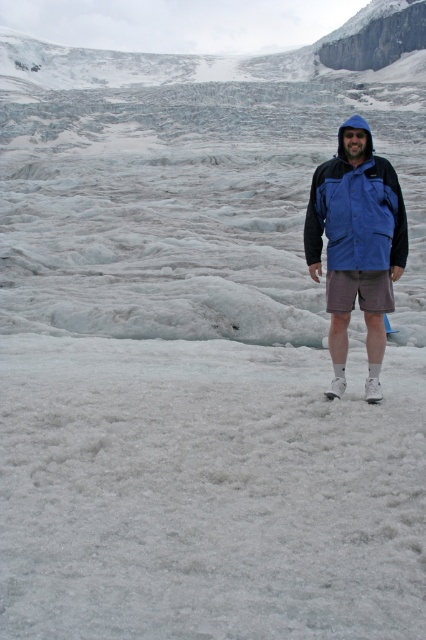
Does point (345, 156) come behind point (334, 307)?

No, it is in front of (334, 307).

Who is more forward, (x=391, y=204) or (x=342, y=285)?

Point (x=391, y=204)

Which is behind, point (354, 145) or point (362, 294)?

The point (362, 294) is more distant.

This screenshot has width=426, height=640. Identify the location of blue waterproof jacket at center. (356, 209).